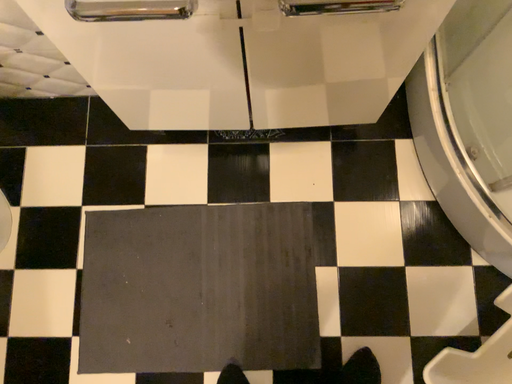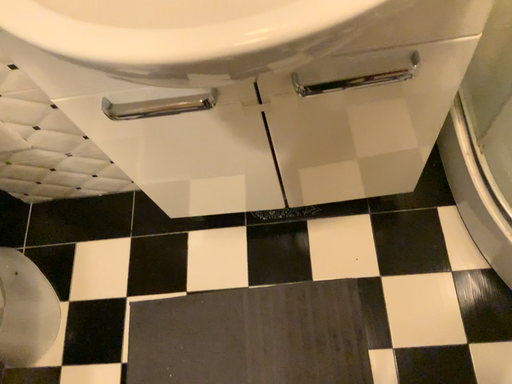
Question: Which way did the camera rotate in the video?

Choices:
 (A) rotated left
 (B) rotated right

Answer: (A)